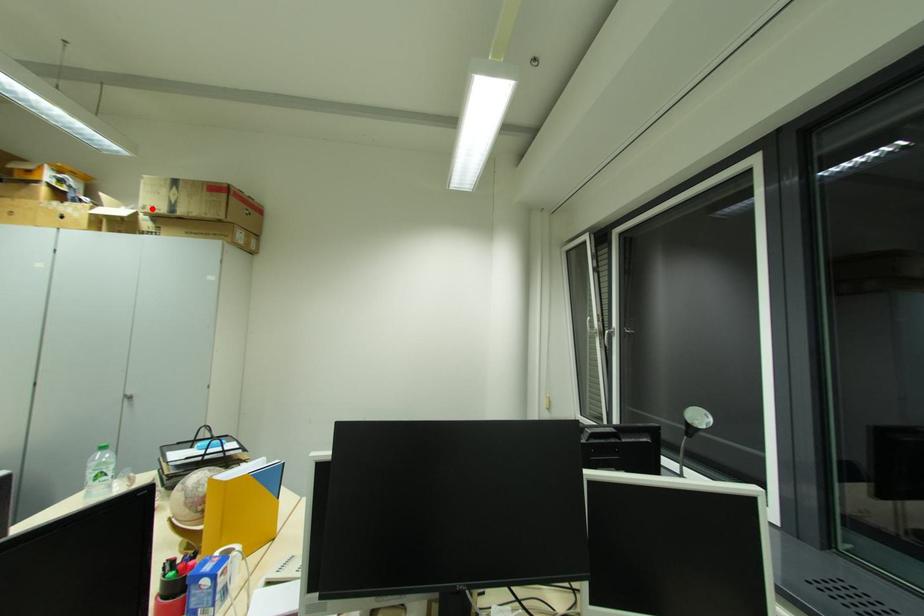
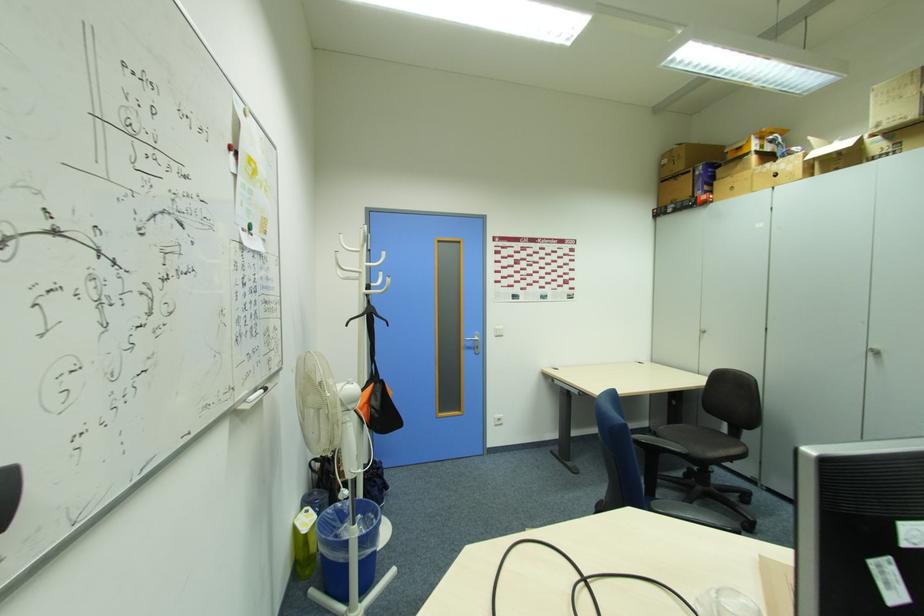
Locate, in the second image, the point that corresponds to the highlighted location in the first image.

(889, 123)